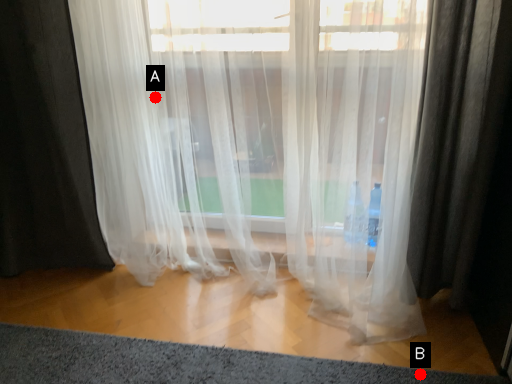
Question: Two points are circled on the image, labeled by A and B beside each circle. Which of the following is the closest to the observer?

Choices:
 (A) A is closer
 (B) B is closer

Answer: (B)